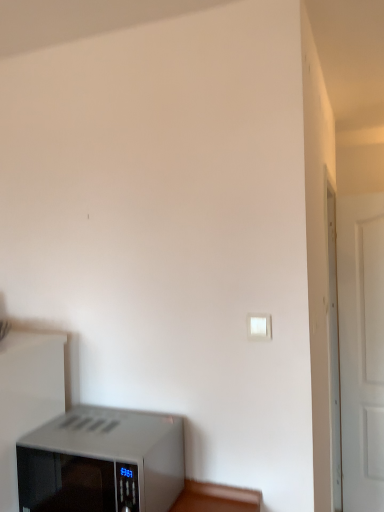
Question: Does white plastic light switch at upper right turn towards white matte door at right?

Choices:
 (A) no
 (B) yes

Answer: (A)

Question: Does white plastic light switch at upper right appear on the right side of white matte door at right?

Choices:
 (A) no
 (B) yes

Answer: (A)

Question: From the image's perspective, does white plastic light switch at upper right appear higher than white matte door at right?

Choices:
 (A) no
 (B) yes

Answer: (B)

Question: Is white plastic light switch at upper right far from white matte door at right?

Choices:
 (A) yes
 (B) no

Answer: (A)

Question: From a real-world perspective, does white plastic light switch at upper right stand above white matte door at right?

Choices:
 (A) no
 (B) yes

Answer: (B)

Question: Is point (342, 298) positioned closer to the camera than point (19, 455)?

Choices:
 (A) farther
 (B) closer

Answer: (A)

Question: Considering their positions, is white matte door at right located in front of or behind satin silver microwave at lower left?

Choices:
 (A) behind
 (B) front

Answer: (A)

Question: Considering the positions of white matte door at right and satin silver microwave at lower left in the image, is white matte door at right taller or shorter than satin silver microwave at lower left?

Choices:
 (A) tall
 (B) short

Answer: (A)

Question: Is white matte door at right wider or thinner than satin silver microwave at lower left?

Choices:
 (A) wide
 (B) thin

Answer: (B)

Question: From a real-world perspective, is white plastic light switch at upper right positioned above or below satin silver microwave at lower left?

Choices:
 (A) above
 (B) below

Answer: (A)

Question: From the image's perspective, is white plastic light switch at upper right located above or below satin silver microwave at lower left?

Choices:
 (A) above
 (B) below

Answer: (A)

Question: Is white plastic light switch at upper right to the left or to the right of satin silver microwave at lower left in the image?

Choices:
 (A) right
 (B) left

Answer: (A)

Question: Is white plastic light switch at upper right wider or thinner than satin silver microwave at lower left?

Choices:
 (A) wide
 (B) thin

Answer: (B)

Question: Is white matte door at right bigger or smaller than white plastic light switch at upper right?

Choices:
 (A) small
 (B) big

Answer: (B)

Question: Relative to white plastic light switch at upper right, is white matte door at right in front or behind?

Choices:
 (A) behind
 (B) front

Answer: (A)